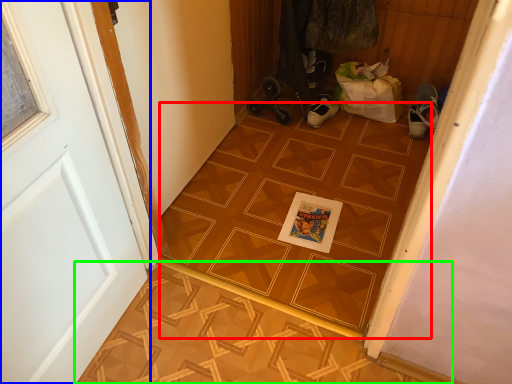
Question: Which is nearer to the ceramic tile (highlighted by a red box)? door (highlighted by a blue box) or tile (highlighted by a green box).

Choices:
 (A) door
 (B) tile

Answer: (B)